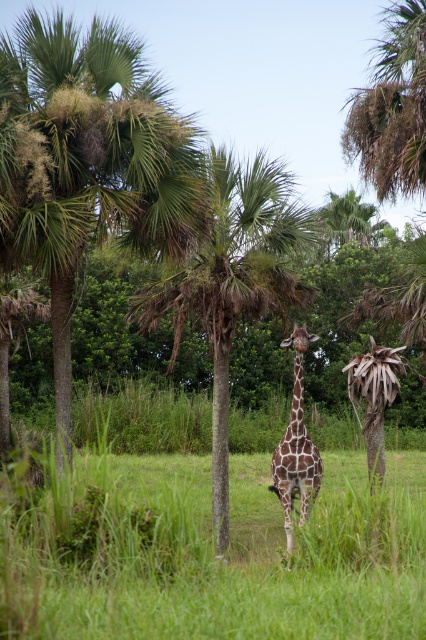
Question: Can you confirm if green leafy palm tree at left is positioned to the right of green leafy palm tree at center?

Choices:
 (A) yes
 (B) no

Answer: (B)

Question: Is the position of green leafy palm tree at left more distant than that of spotted fur giraffe at center?

Choices:
 (A) no
 (B) yes

Answer: (A)

Question: Which object appears closest to the camera in this image?

Choices:
 (A) spotted fur giraffe at center
 (B) green leafy palm tree at center
 (C) green leafy palm tree at left

Answer: (C)

Question: Among these objects, which one is farthest from the camera?

Choices:
 (A) green leafy palm tree at left
 (B) spotted fur giraffe at center

Answer: (B)

Question: Does green leafy palm tree at left have a larger size compared to spotted fur giraffe at center?

Choices:
 (A) no
 (B) yes

Answer: (B)

Question: Which object is the closest to the green leafy palm tree at left?

Choices:
 (A) spotted fur giraffe at center
 (B) green leafy palm tree at center

Answer: (B)